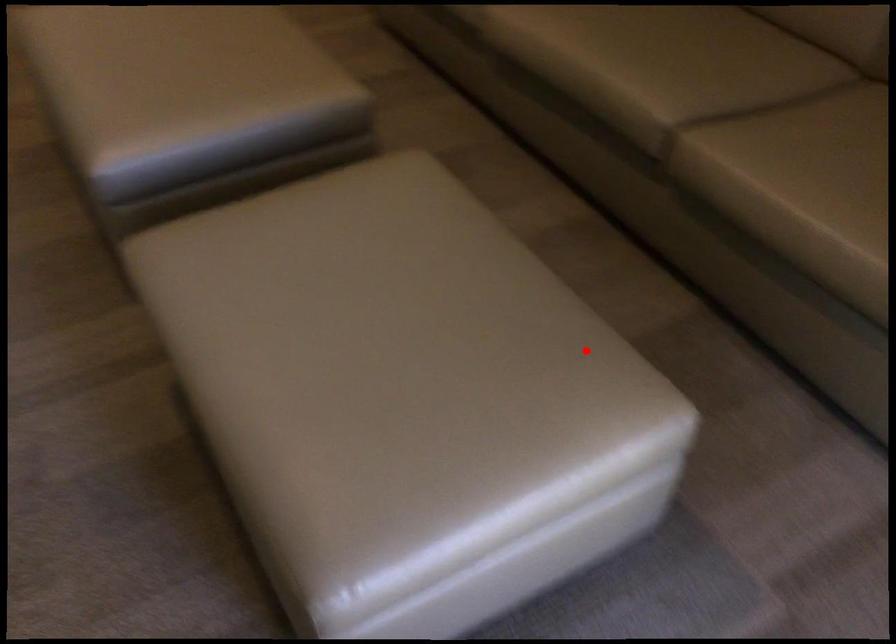
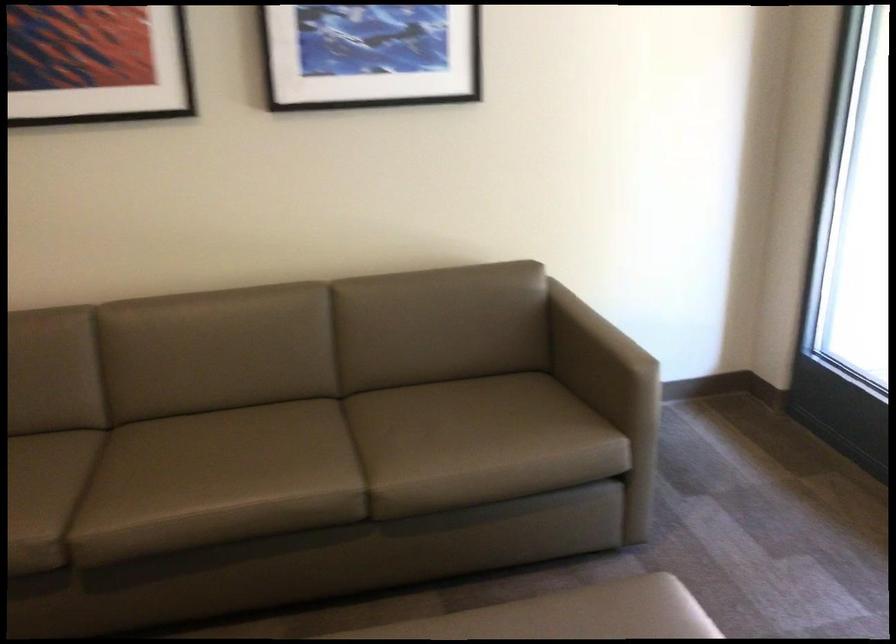
Question: I am providing you with two images of the same scene from different viewpoints. Given a red point in image1, look at the same physical point in image2. Is it:

Choices:
 (A) Closer to the viewpoint
 (B) Farther from the viewpoint

Answer: (B)